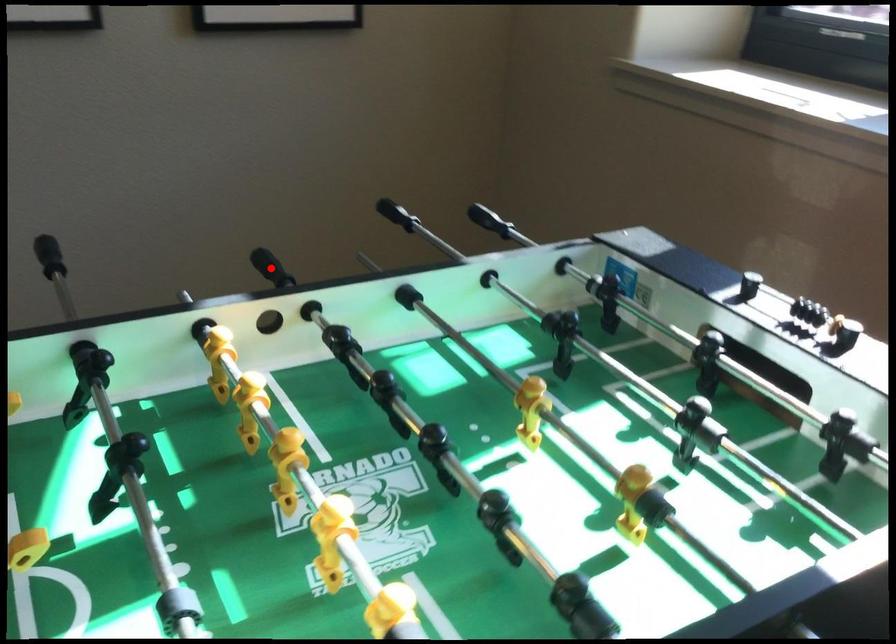
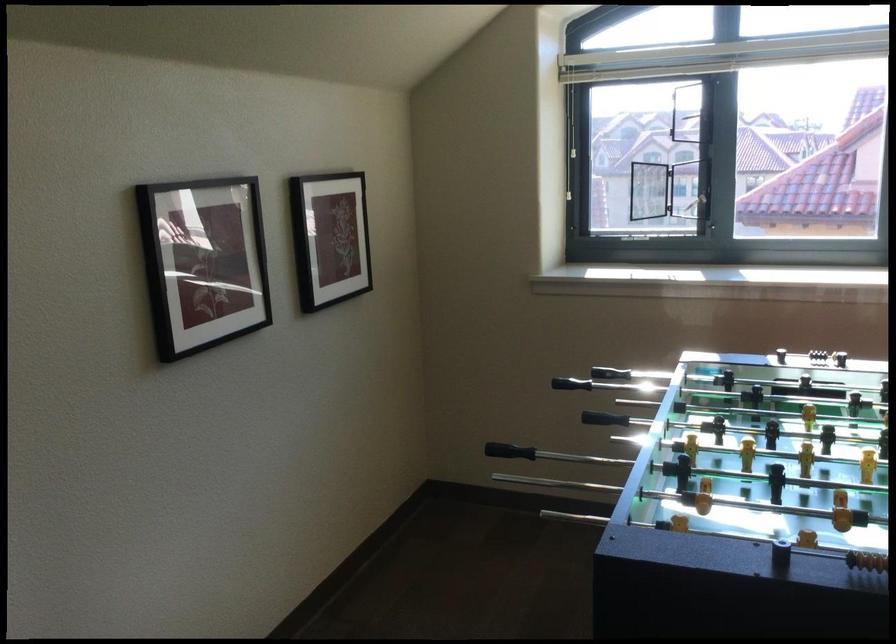
Question: I am providing you with two images of the same scene from different viewpoints. Image1 has a red point marked. In image2, the corresponding 3D location appears at what relative position? Reply with the corresponding letter.

Choices:
 (A) Closer
 (B) Farther

Answer: (B)